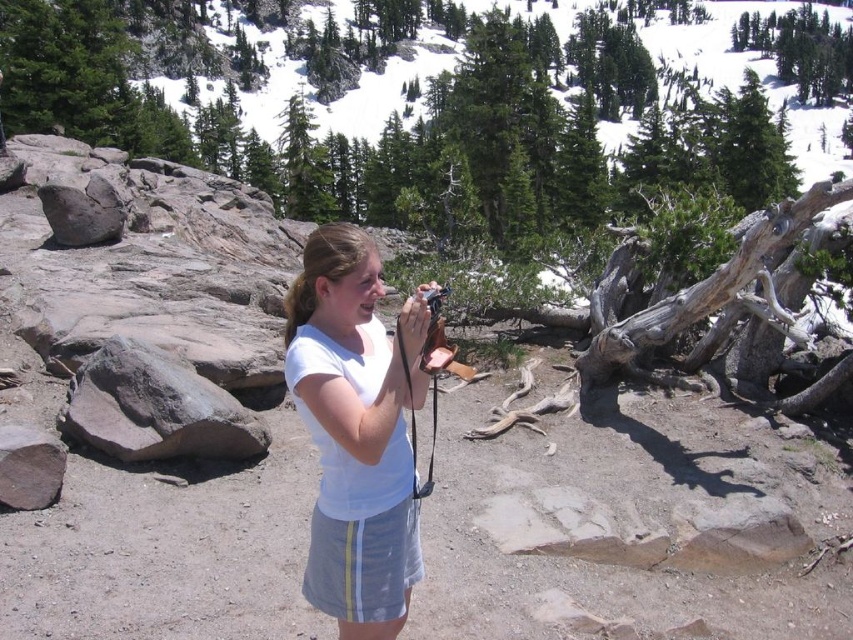
Where is the white cotton shirt at center located in the image?

The white cotton shirt at center is located at point (357,432).